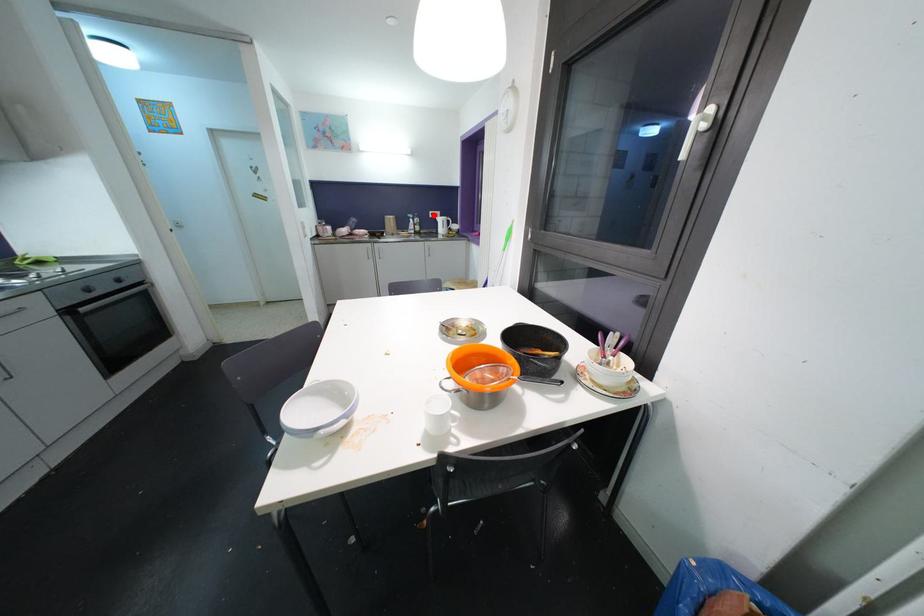
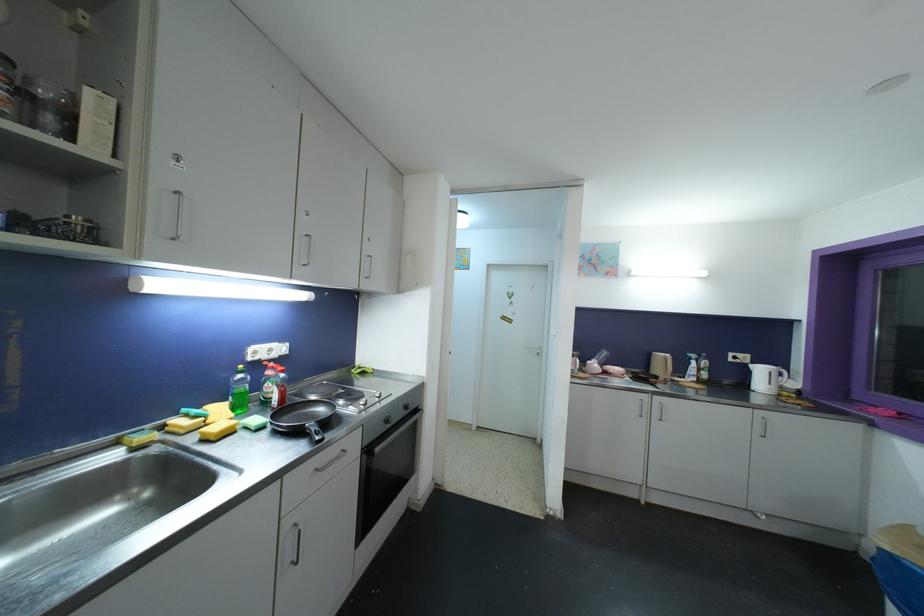
Question: I am providing you with two images of the same scene from different viewpoints. Given a red point in image1, look at the same physical point in image2. Is it:

Choices:
 (A) Closer to the viewpoint
 (B) Farther from the viewpoint

Answer: (B)